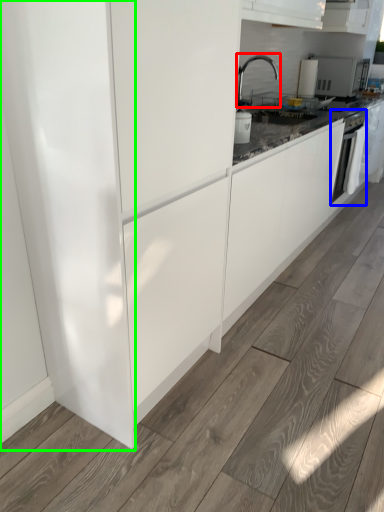
Question: Which object is positioned farthest from tap (highlighted by a red box)? Select from home appliance (highlighted by a blue box) and glass door (highlighted by a green box).

Choices:
 (A) home appliance
 (B) glass door

Answer: (B)